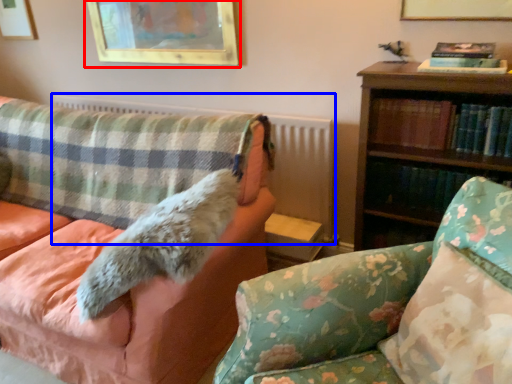
Question: Which point is closer to the camera, picture frame (highlighted by a red box) or radiator (highlighted by a blue box)?

Choices:
 (A) picture frame
 (B) radiator

Answer: (B)